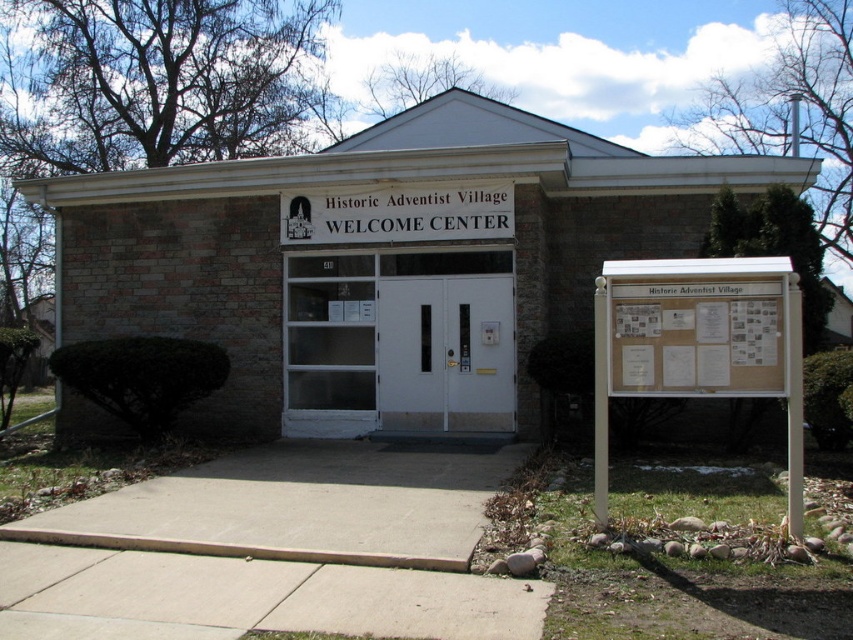
Question: Which object appears farthest from the camera in this image?

Choices:
 (A) white wood signboard at right
 (B) white wood sign at center

Answer: (B)

Question: Can you confirm if white wood signboard at right is thinner than white wood sign at center?

Choices:
 (A) no
 (B) yes

Answer: (B)

Question: Among these objects, which one is nearest to the camera?

Choices:
 (A) white wood signboard at right
 (B) white wood sign at center

Answer: (A)

Question: Is white wood signboard at right positioned in front of white wood sign at center?

Choices:
 (A) yes
 (B) no

Answer: (A)

Question: Can you confirm if white wood signboard at right is wider than white wood sign at center?

Choices:
 (A) no
 (B) yes

Answer: (A)